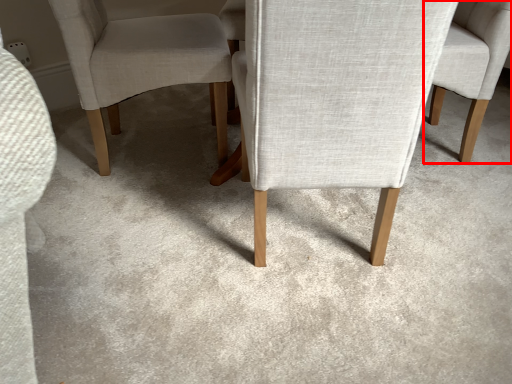
Question: From the image, what is the correct spatial relationship of chair (annotated by the red box) in relation to chair?

Choices:
 (A) right
 (B) left

Answer: (A)